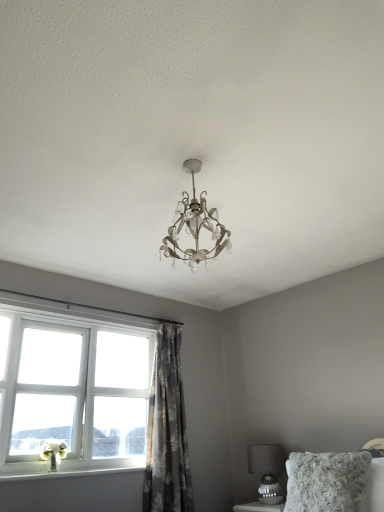
Question: From the image's perspective, does gray floral fabric curtain at center appear higher than fluffy white pillow at lower right?

Choices:
 (A) yes
 (B) no

Answer: (A)

Question: Does gray floral fabric curtain at center have a greater width compared to fluffy white pillow at lower right?

Choices:
 (A) no
 (B) yes

Answer: (A)

Question: Does gray floral fabric curtain at center have a larger size compared to fluffy white pillow at lower right?

Choices:
 (A) no
 (B) yes

Answer: (B)

Question: Can you see gray floral fabric curtain at center touching fluffy white pillow at lower right?

Choices:
 (A) no
 (B) yes

Answer: (A)

Question: Considering the relative sizes of gray floral fabric curtain at center and fluffy white pillow at lower right in the image provided, is gray floral fabric curtain at center smaller than fluffy white pillow at lower right?

Choices:
 (A) yes
 (B) no

Answer: (B)

Question: From the image's perspective, would you say gray floral fabric curtain at center is shown under fluffy white pillow at lower right?

Choices:
 (A) yes
 (B) no

Answer: (B)

Question: Does white painted wood at lower left have a greater height compared to metallic silver table lamp at lower right?

Choices:
 (A) yes
 (B) no

Answer: (B)

Question: Is white painted wood at lower left facing towards metallic silver table lamp at lower right?

Choices:
 (A) no
 (B) yes

Answer: (A)

Question: Is white painted wood at lower left positioned in front of metallic silver table lamp at lower right?

Choices:
 (A) yes
 (B) no

Answer: (A)

Question: From a real-world perspective, is white painted wood at lower left positioned under metallic silver table lamp at lower right based on gravity?

Choices:
 (A) yes
 (B) no

Answer: (B)

Question: Does white painted wood at lower left have a lesser height compared to metallic silver table lamp at lower right?

Choices:
 (A) no
 (B) yes

Answer: (B)

Question: Can you confirm if white painted wood at lower left is thinner than metallic silver table lamp at lower right?

Choices:
 (A) yes
 (B) no

Answer: (A)

Question: Does gray floral fabric curtain at center have a larger size compared to metallic silver table lamp at lower right?

Choices:
 (A) yes
 (B) no

Answer: (A)